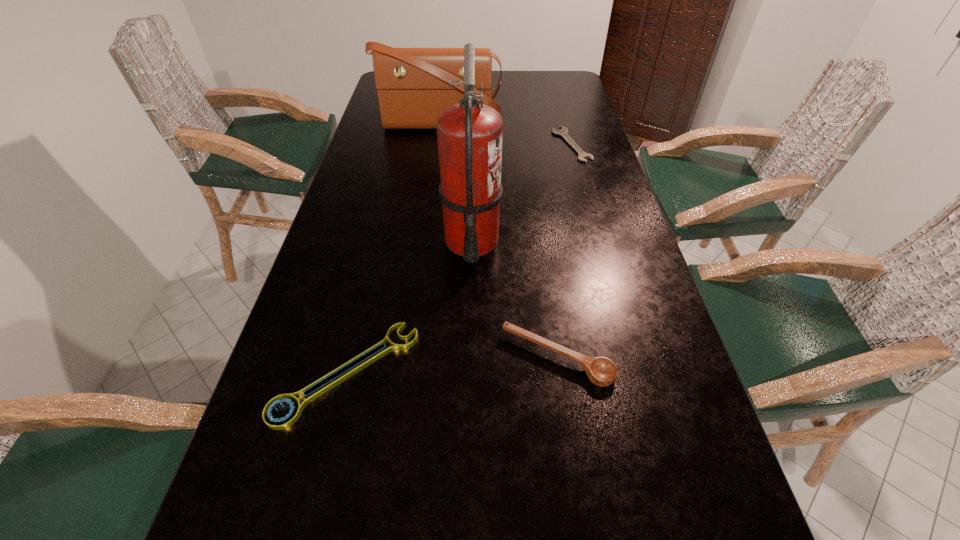
The height and width of the screenshot is (540, 960). I want to click on free space located 0.250m on the left of the farther wrench, so click(474, 145).

The height and width of the screenshot is (540, 960). I want to click on satchel located at the left edge, so click(412, 84).

Image resolution: width=960 pixels, height=540 pixels. In order to click on wrench located at the left edge in this screenshot , I will do `click(279, 424)`.

Where is `wooden spoon at the right edge`? wooden spoon at the right edge is located at coordinates (601, 371).

The width and height of the screenshot is (960, 540). Identify the location of wrench present at the right edge. (563, 132).

Identify the location of free space at the far edge of the desktop. (520, 93).

The height and width of the screenshot is (540, 960). I want to click on vacant position at the left edge of the desktop, so click(x=305, y=314).

Where is `vacant space at the right edge`? vacant space at the right edge is located at coordinates (556, 143).

In the image, there is a desktop. Find the location of `vacant area at the far right corner`. vacant area at the far right corner is located at coordinates (539, 82).

At what (x,y) coordinates should I click in order to perform the action: click on vacant region between the left wrench and the wooden spoon. Please return your answer as a coordinate pair (x, y). The width and height of the screenshot is (960, 540). Looking at the image, I should click on (452, 366).